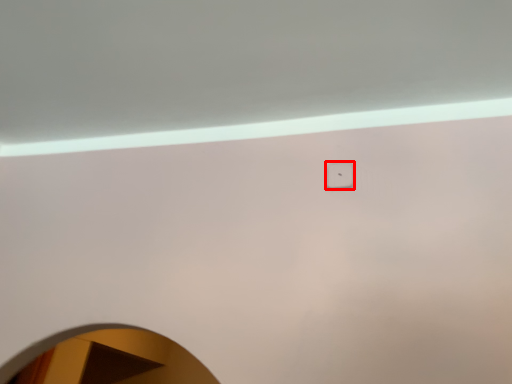
Question: From the image's perspective, what is the correct spatial relationship of light switch (annotated by the red box) in relation to mirror?

Choices:
 (A) above
 (B) below

Answer: (A)